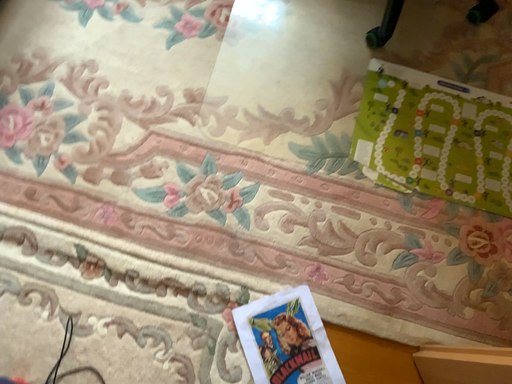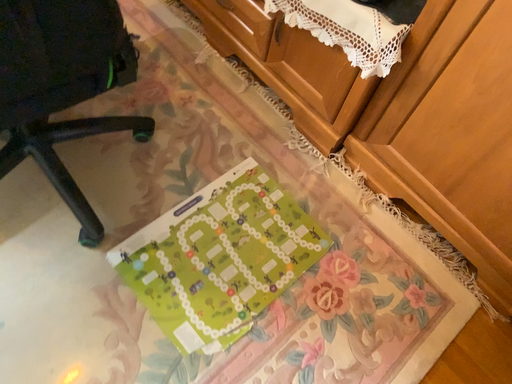
Question: Which way did the camera rotate in the video?

Choices:
 (A) rotated upward
 (B) rotated downward

Answer: (A)